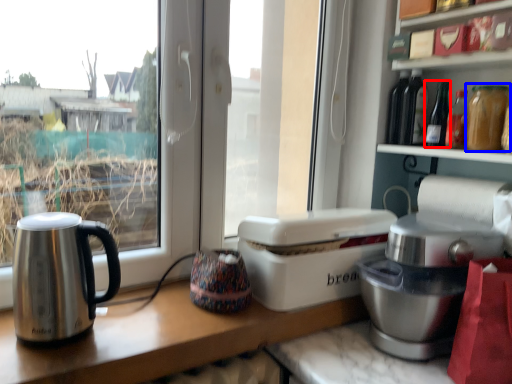
Question: Which object is closer to the camera taking this photo, bottle (highlighted by a red box) or bottle (highlighted by a blue box)?

Choices:
 (A) bottle
 (B) bottle

Answer: (B)